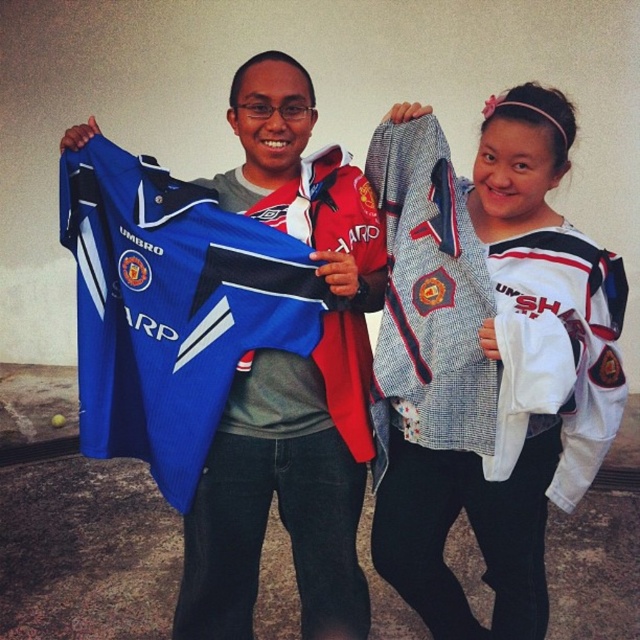
Question: Which of the following is the farthest from the observer?

Choices:
 (A) (337, 560)
 (B) (592, 413)

Answer: (A)

Question: Can you confirm if white textured jacket at upper right is positioned above blue mesh jersey at center?

Choices:
 (A) no
 (B) yes

Answer: (A)

Question: Which object appears farthest from the camera in this image?

Choices:
 (A) white textured jacket at upper right
 (B) blue mesh jersey at center

Answer: (B)

Question: Is white textured jacket at upper right above blue mesh jersey at center?

Choices:
 (A) yes
 (B) no

Answer: (B)

Question: Is white textured jacket at upper right below blue mesh jersey at center?

Choices:
 (A) no
 (B) yes

Answer: (B)